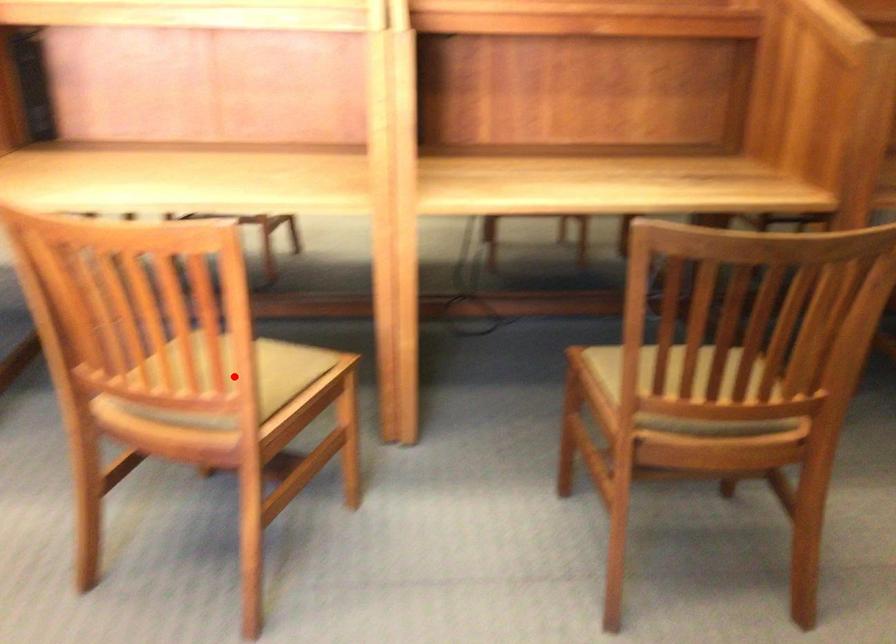
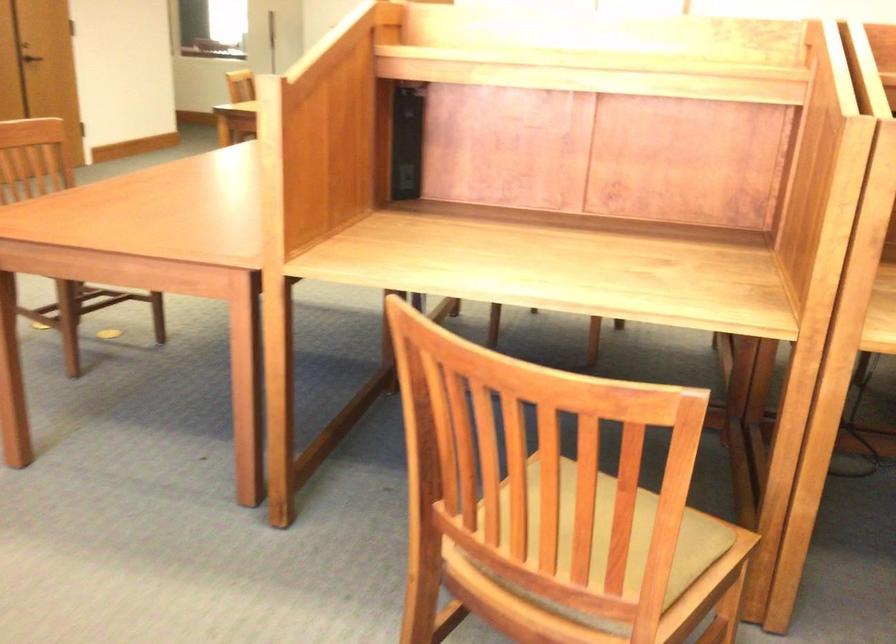
Question: A red point is marked in image1. In image2, is the corresponding 3D point closer to the camera or farther? Reply with the corresponding letter.

Choices:
 (A) The corresponding 3D point is closer.
 (B) The corresponding 3D point is farther.

Answer: (A)